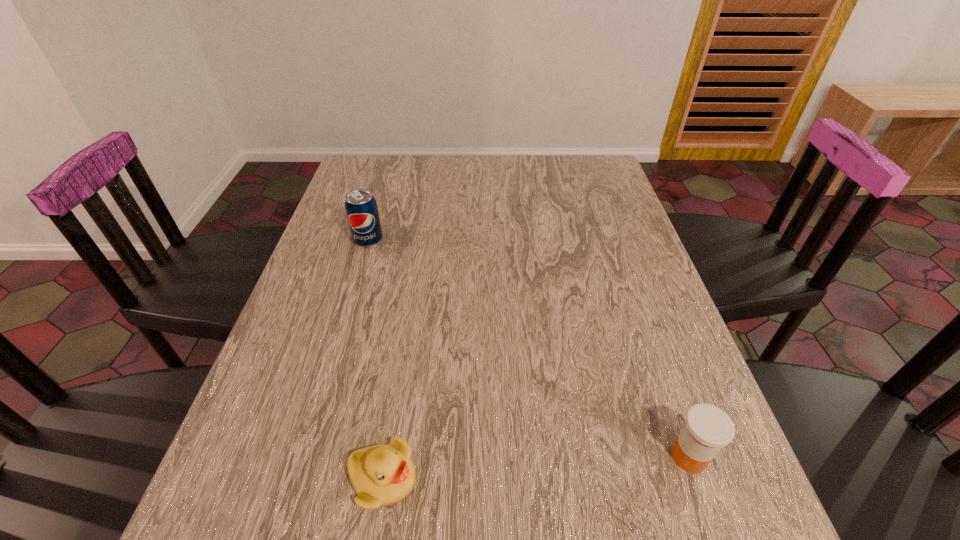
This screenshot has height=540, width=960. I want to click on vacant space located 0.160m on the front-facing side of the second object from left to right, so click(x=514, y=479).

Locate an element on the screen. object positioned at the near edge is located at coordinates (384, 474).

Locate an element on the screen. This screenshot has width=960, height=540. object at the left edge is located at coordinates (361, 208).

This screenshot has height=540, width=960. What are the coordinates of `object that is at the right edge` in the screenshot? It's located at coord(707,429).

In the image, there is a desktop. At what (x,y) coordinates should I click in order to perform the action: click on free space at the far edge. Please return your answer as a coordinate pair (x, y). The image size is (960, 540). Looking at the image, I should click on (470, 165).

In order to click on vacant space at the left edge of the desktop in this screenshot , I will do (x=327, y=400).

Locate an element on the screen. This screenshot has height=540, width=960. vacant space at the right edge of the desktop is located at coordinates (626, 249).

I want to click on free spot at the far left corner of the desktop, so click(x=351, y=176).

Locate an element on the screen. Image resolution: width=960 pixels, height=540 pixels. free region at the near left corner of the desktop is located at coordinates (290, 532).

This screenshot has width=960, height=540. What are the coordinates of `vacant space at the far right corner of the desktop` in the screenshot? It's located at (584, 161).